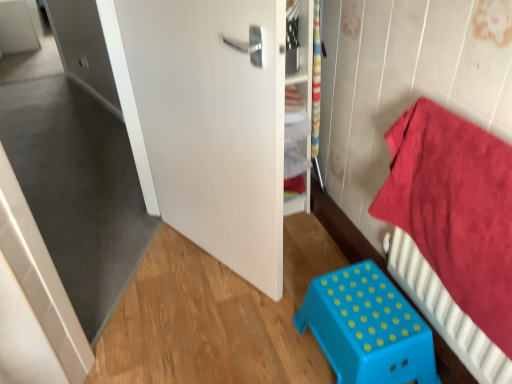
You are a GUI agent. You are given a task and a screenshot of the screen. Output one action in this format:
    pyautogui.click(x=<x>, y=<y>)
    Task: Click on the blank space above red cotton towel at right (from a real-world perspective)
    
    Given the screenshot: What is the action you would take?
    tap(480, 132)